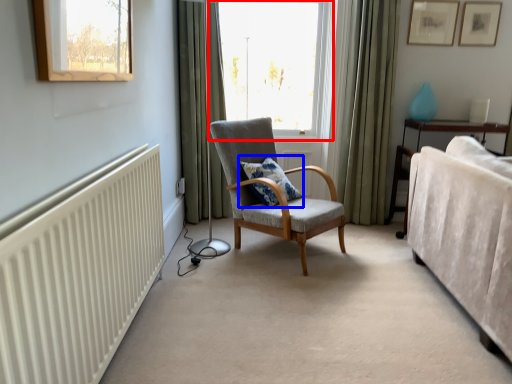
Question: Among these objects, which one is farthest to the camera, window (highlighted by a red box) or pillow (highlighted by a blue box)?

Choices:
 (A) window
 (B) pillow

Answer: (A)